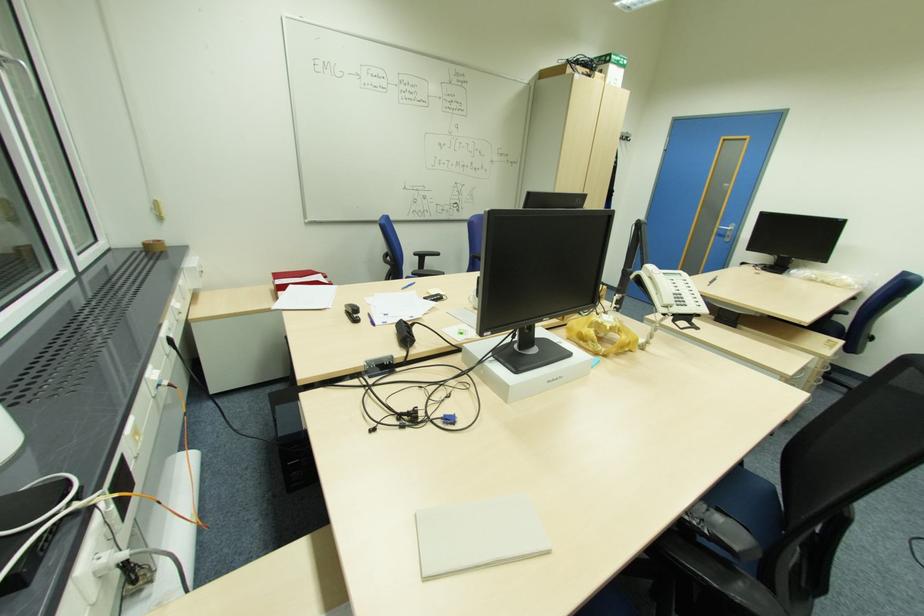
Where would you lift the red document folder? Please return your answer as a coordinate pair (x, y).

(298, 278)